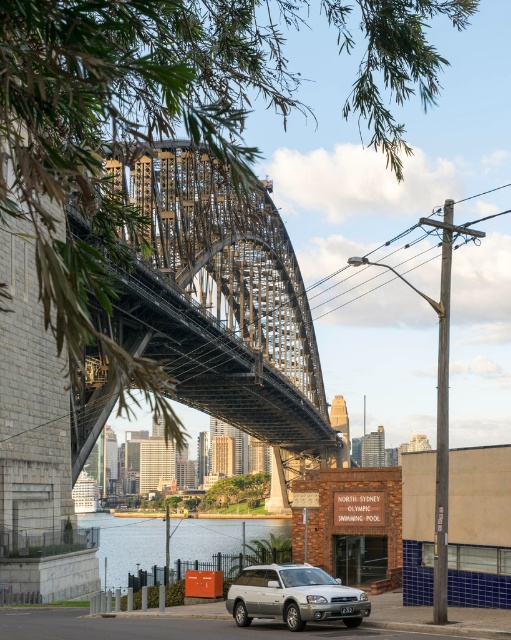
Does metallic steel bridge at center lie in front of blue water at lower left?

Yes, metallic steel bridge at center is in front of blue water at lower left.

What do you see at coordinates (223, 301) in the screenshot? Image resolution: width=511 pixels, height=640 pixels. I see `metallic steel bridge at center` at bounding box center [223, 301].

Between point (218, 179) and point (118, 572), which one is positioned behind?

Positioned behind is point (118, 572).

I want to click on metallic steel bridge at center, so click(223, 301).

Is point (196, 518) positioned behind point (309, 586)?

Yes, it is.

Which is in front, point (202, 525) or point (244, 616)?

Point (244, 616) is in front.

Is point (103, 525) farther from viewer compared to point (267, 566)?

That is True.

The width and height of the screenshot is (511, 640). I want to click on blue water at lower left, so coord(127,544).

Does metallic steel bridge at center lie in front of silver metallic station wagon at center?

Yes, metallic steel bridge at center is in front of silver metallic station wagon at center.

How far apart are metallic steel bridge at center and silver metallic station wagon at center?

A distance of 62.27 meters exists between metallic steel bridge at center and silver metallic station wagon at center.

Does point (146, 317) come in front of point (249, 602)?

No, (146, 317) is further to viewer.

The width and height of the screenshot is (511, 640). In order to click on metallic steel bridge at center in this screenshot , I will do `click(223, 301)`.